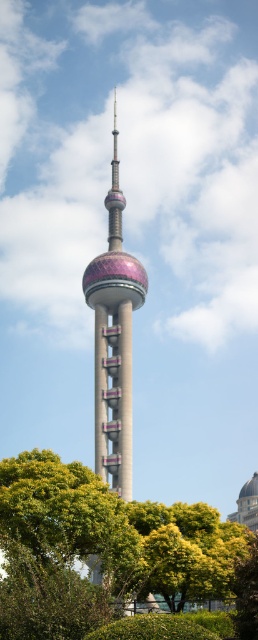
Is green leafy tree at center further to camera compared to metallic silver tower at center?

No, green leafy tree at center is in front of metallic silver tower at center.

Can you confirm if green leafy tree at center is taller than metallic silver tower at center?

Incorrect, green leafy tree at center's height is not larger of metallic silver tower at center's.

The height and width of the screenshot is (640, 258). What do you see at coordinates (100, 548) in the screenshot?
I see `green leafy tree at center` at bounding box center [100, 548].

Identify the location of green leafy tree at center. Image resolution: width=258 pixels, height=640 pixels. (100, 548).

Can you confirm if green leafy tree at lower center is positioned to the left of metallic silver tower at center?

In fact, green leafy tree at lower center is to the right of metallic silver tower at center.

Is point (194, 556) in front of point (110, 339)?

Yes, point (194, 556) is in front of point (110, 339).

Between point (121, 572) and point (113, 481), which one is positioned in front?

Point (121, 572) is in front.

The height and width of the screenshot is (640, 258). What are the coordinates of `green leafy tree at lower center` in the screenshot? It's located at (176, 552).

Does green leafy tree at center appear over green leafy tree at lower center?

Incorrect, green leafy tree at center is not positioned above green leafy tree at lower center.

Measure the distance between green leafy tree at center and green leafy tree at lower center.

They are 1.96 meters apart.

Is point (168, 593) positioned after point (165, 508)?

That is False.

This screenshot has height=640, width=258. In order to click on green leafy tree at center in this screenshot , I will do `click(100, 548)`.